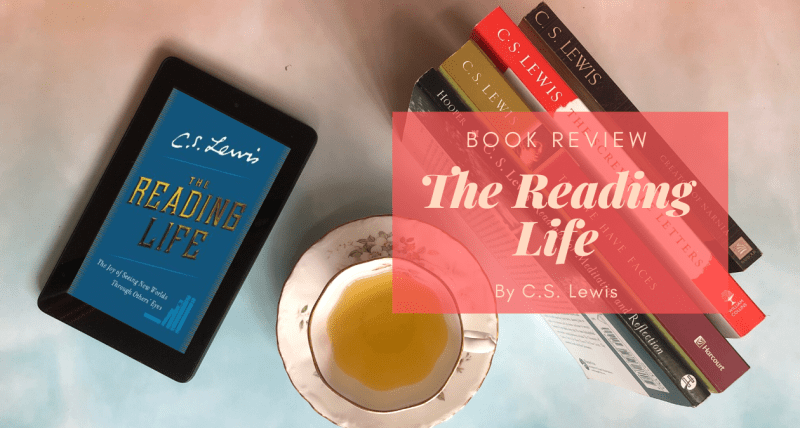
You are a GUI agent. You are given a task and a screenshot of the screen. Output one action in this format:
    pyautogui.click(x=<x>, y=<y>)
    Task: Click on the size of teacup
    The height and width of the screenshot is (428, 800).
    Given the screenshot: What is the action you would take?
    pyautogui.click(x=349, y=268), pyautogui.click(x=321, y=294), pyautogui.click(x=322, y=380), pyautogui.click(x=412, y=404), pyautogui.click(x=460, y=335), pyautogui.click(x=426, y=271)